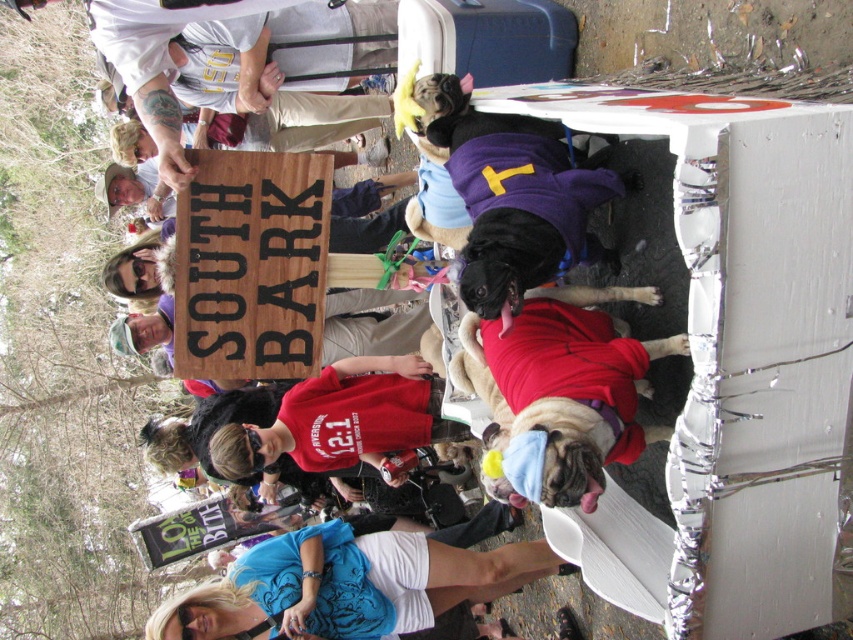
Consider the image. Between wooden sign at center and blue cotton shirt at lower center, which one has less height?

blue cotton shirt at lower center

Can you confirm if wooden sign at center is positioned to the right of blue cotton shirt at lower center?

Incorrect, wooden sign at center is not on the right side of blue cotton shirt at lower center.

Identify the location of wooden sign at center. This screenshot has height=640, width=853. (251, 264).

Locate an element on the screen. The height and width of the screenshot is (640, 853). wooden sign at center is located at coordinates (251, 264).

Is blue cotton shirt at lower center above red fabric dog at center?

No, blue cotton shirt at lower center is not above red fabric dog at center.

Does blue cotton shirt at lower center appear on the left side of red fabric dog at center?

Indeed, blue cotton shirt at lower center is positioned on the left side of red fabric dog at center.

Image resolution: width=853 pixels, height=640 pixels. I want to click on blue cotton shirt at lower center, so click(347, 584).

This screenshot has width=853, height=640. What are the coordinates of `blue cotton shirt at lower center` in the screenshot? It's located at (347, 584).

Between wooden sign at center and red fabric dog at center, which one is positioned lower?

red fabric dog at center is below.

Which is above, wooden sign at center or red fabric dog at center?

Positioned higher is wooden sign at center.

Is point (225, 186) more distant than point (608, 348)?

Yes, it is behind point (608, 348).

You are a GUI agent. You are given a task and a screenshot of the screen. Output one action in this format:
    pyautogui.click(x=<x>, y=<y>)
    Task: Click on the wooden sign at center
    The width and height of the screenshot is (853, 640).
    Given the screenshot: What is the action you would take?
    pyautogui.click(x=251, y=264)